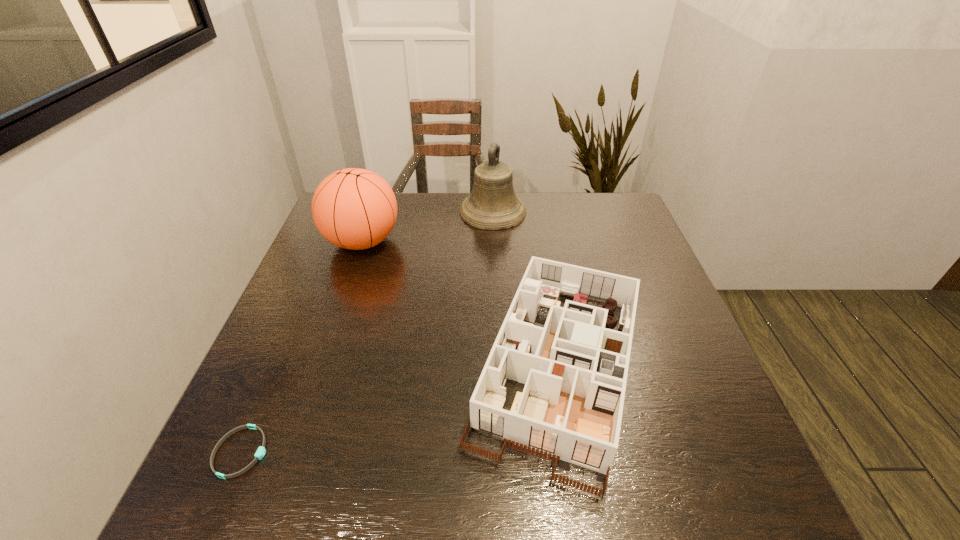
Where is `dollhouse that is at the near edge`? dollhouse that is at the near edge is located at coordinates (574, 368).

You are a GUI agent. You are given a task and a screenshot of the screen. Output one action in this format:
    pyautogui.click(x=<x>, y=<y>)
    Task: Click on the wristband located at the near edge
    
    Given the screenshot: What is the action you would take?
    pyautogui.click(x=261, y=451)

I want to click on basketball at the left edge, so click(x=353, y=208).

Locate an element on the screen. wristband positioned at the left edge is located at coordinates (261, 451).

You are a GUI agent. You are given a task and a screenshot of the screen. Output one action in this format:
    pyautogui.click(x=<x>, y=<y>)
    Task: Click on the object that is positioned at the right edge
    
    Given the screenshot: What is the action you would take?
    point(574,368)

Find the location of a particular element. Image resolution: width=960 pixels, height=540 pixels. object that is positioned at the far left corner is located at coordinates coord(353,208).

You are a GUI agent. You are given a task and a screenshot of the screen. Output one action in this format:
    pyautogui.click(x=<x>, y=<y>)
    Task: Click on the object at the near left corner
    Image resolution: width=960 pixels, height=540 pixels.
    Given the screenshot: What is the action you would take?
    pyautogui.click(x=261, y=451)

Locate an element on the screen. The image size is (960, 540). object present at the near right corner is located at coordinates (574, 368).

Where is `vacant space at the far edge of the desktop`? Image resolution: width=960 pixels, height=540 pixels. vacant space at the far edge of the desktop is located at coordinates (517, 233).

The width and height of the screenshot is (960, 540). I want to click on free space at the near edge of the desktop, so click(613, 463).